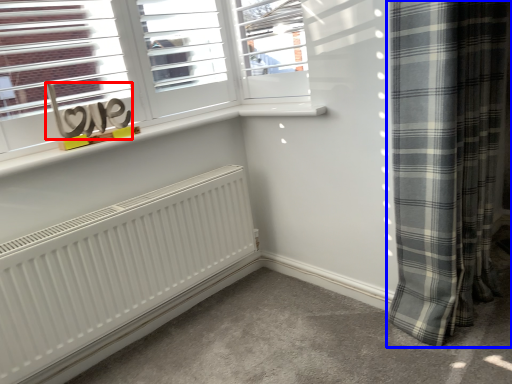
Question: Among these objects, which one is farthest to the camera, writing (highlighted by a red box) or curtain (highlighted by a blue box)?

Choices:
 (A) writing
 (B) curtain

Answer: (A)